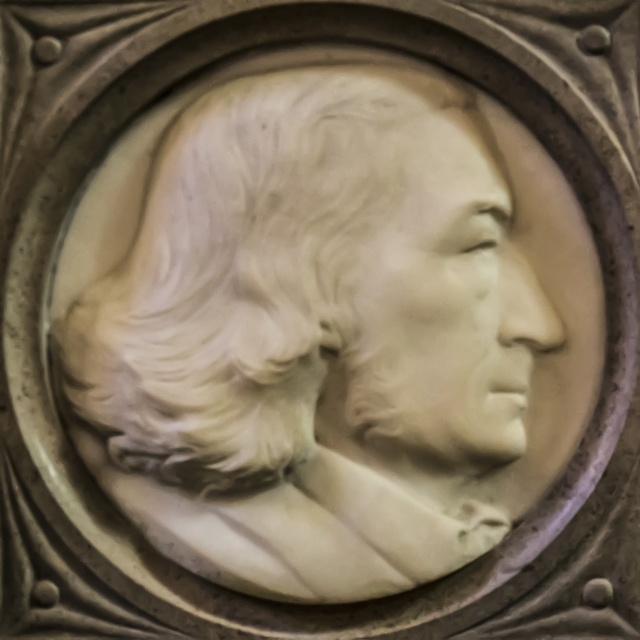
Is white marble bust at center wider than white marble face at center?

Indeed, white marble bust at center has a greater width compared to white marble face at center.

Which is above, white marble bust at center or white marble face at center?

white marble face at center is above.

What do you see at coordinates (326, 330) in the screenshot? The height and width of the screenshot is (640, 640). I see `white marble bust at center` at bounding box center [326, 330].

Locate an element on the screen. The width and height of the screenshot is (640, 640). white marble bust at center is located at coordinates (326, 330).